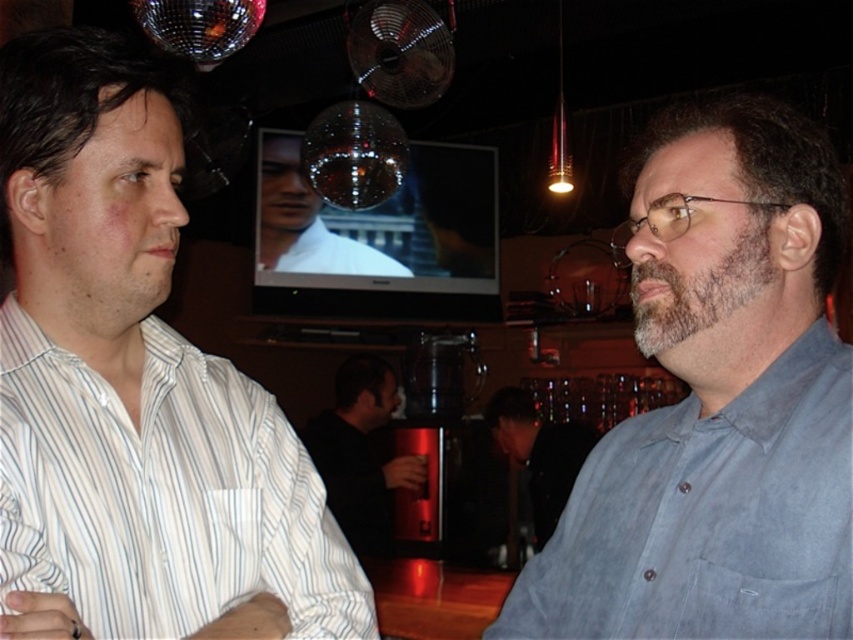
Question: Observing the image, what is the correct spatial positioning of white striped cotton shirt at left in reference to white matte shirt at center?

Choices:
 (A) left
 (B) right

Answer: (B)

Question: From the image, what is the correct spatial relationship of gray cotton shirt at right in relation to dark gray shirt at center?

Choices:
 (A) below
 (B) above

Answer: (B)

Question: Considering the real-world distances, which object is farthest from the black matte shirt at center?

Choices:
 (A) white striped cotton shirt at left
 (B) gray cotton shirt at right

Answer: (B)

Question: Which point is closer to the camera?

Choices:
 (A) (521, 404)
 (B) (850, 376)
 (C) (369, 264)
 (D) (138, 499)

Answer: (B)

Question: Which of these objects is positioned closest to the black matte shirt at center?

Choices:
 (A) white striped cotton shirt at left
 (B) white matte shirt at center
 (C) dark gray shirt at center
 (D) gray cotton shirt at right

Answer: (C)

Question: Does gray cotton shirt at right appear over dark gray shirt at center?

Choices:
 (A) no
 (B) yes

Answer: (B)